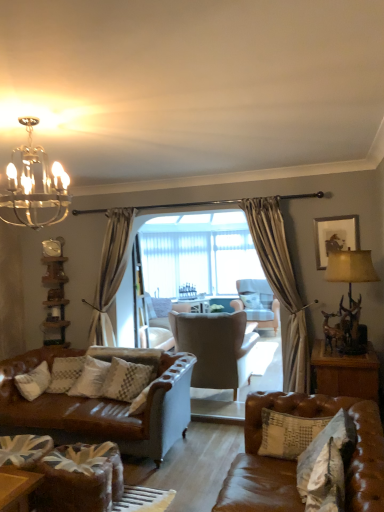
Image resolution: width=384 pixels, height=512 pixels. In order to click on vacant point above gold metallic chandelier at upper left (from a real-world perspective) in this screenshot , I will do `click(31, 119)`.